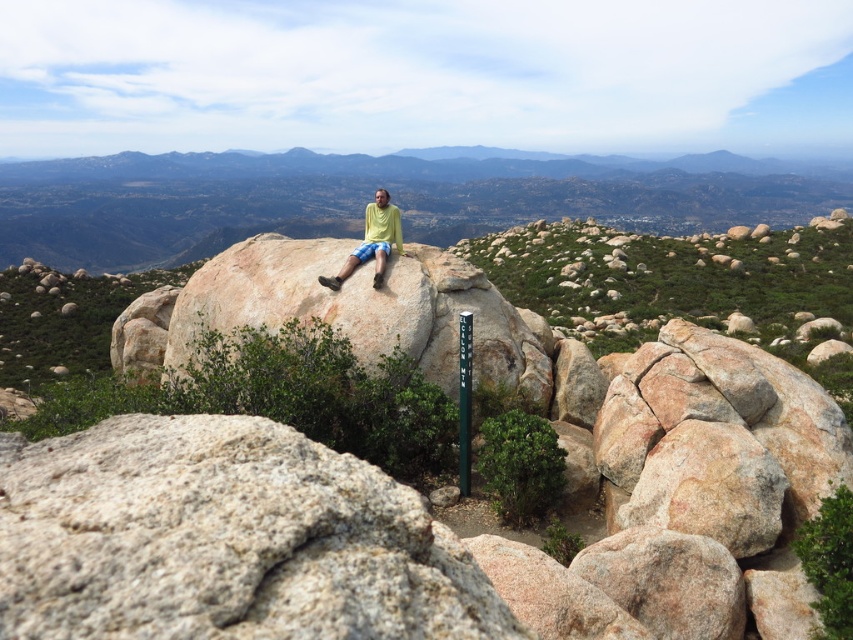
You are a hiker planning to climb the gray granite boulder at center and the smooth granite boulder at center. Which one should you attempt first based on their positions?

You should climb the smooth granite boulder at center first because the gray granite boulder at center is located below it, meaning the smooth one is higher up and requires reaching it first.

In the scene shown: You are a hiker who wants to take a photo of the smooth granite boulder at center and the matte yellow shirt at center. To ensure both are fully visible in the frame, which object should you position closer to the camera?

You should position the matte yellow shirt at center closer to the camera because the smooth granite boulder at center is much taller, so the shirt needs to be nearer to avoid being obscured by the boulder.